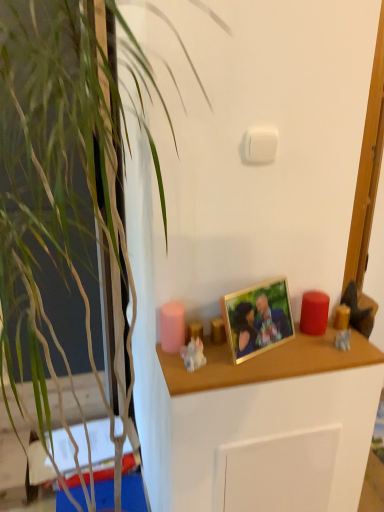
Image resolution: width=384 pixels, height=512 pixels. I want to click on free space above wooden cabinet at center (from a real-world perspective), so [x=267, y=348].